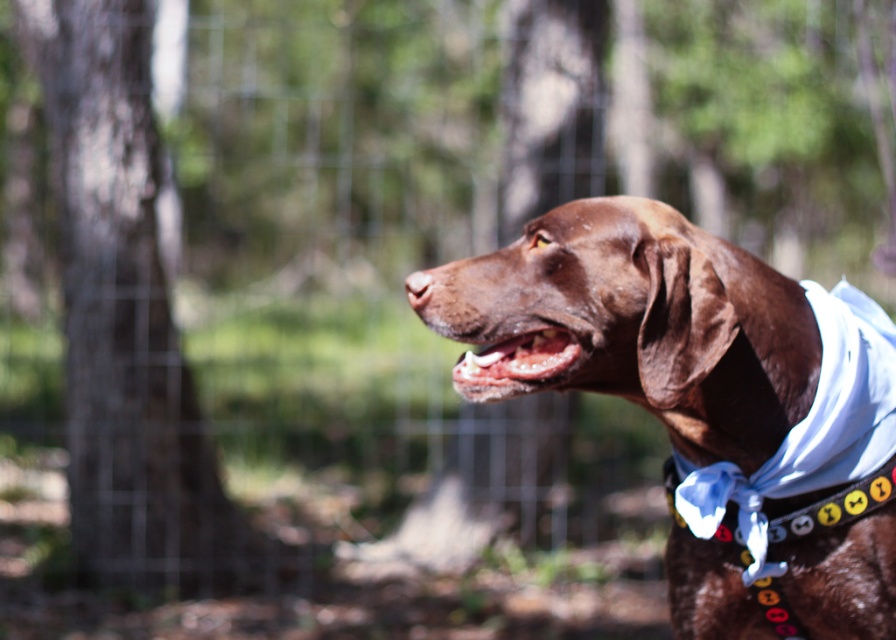
You are a photographer taking a picture of the brown dog at center. The camera has a focus point at coordinate point (643, 321). Is the focus point correctly placed to capture the dog?

The point (643, 321) marks brown fur dog at center, so yes, the focus point is correctly placed to capture the dog.

You are a photographer trying to capture the brown fur dog at center and the pink glossy teeth at center in a single frame. Which object should you focus on if you want to ensure both are fully visible without cropping?

The brown fur dog at center is wider than the pink glossy teeth at center, so focusing on the dog will ensure both are fully visible without cropping.

You are standing in a forest and see a brown dog wearing a light blue bandana and collar with colorful tags. There is a point marked at coordinates (128, 324). What does this point indicate?

The point at coordinates (128, 324) marks the location of the brown bark tree at left.